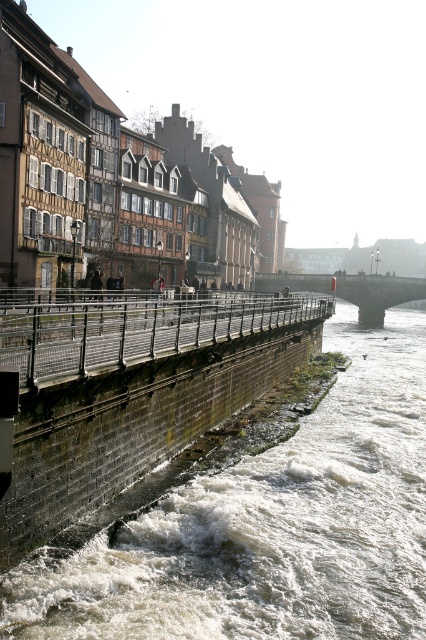
Measure the distance between rough concrete river at center and dark gray stone bridge at center.

rough concrete river at center is 114.19 feet away from dark gray stone bridge at center.

Image resolution: width=426 pixels, height=640 pixels. I want to click on rough concrete river at center, so click(x=273, y=525).

What are the coordinates of `rough concrete river at center` in the screenshot? It's located at (273, 525).

The height and width of the screenshot is (640, 426). I want to click on rough concrete river at center, so click(x=273, y=525).

Consider the image. Is metal/rustic rail at left to the left of dark gray stone bridge at center from the viewer's perspective?

Correct, you'll find metal/rustic rail at left to the left of dark gray stone bridge at center.

This screenshot has width=426, height=640. What do you see at coordinates (135, 330) in the screenshot? I see `metal/rustic rail at left` at bounding box center [135, 330].

The width and height of the screenshot is (426, 640). What are the coordinates of `metal/rustic rail at left` in the screenshot? It's located at (135, 330).

Is point (402, 541) behind point (167, 342)?

No, (402, 541) is closer to viewer.

Does rough concrete river at center have a smaller size compared to metal/rustic rail at left?

Yes.

Describe the element at coordinates (273, 525) in the screenshot. The height and width of the screenshot is (640, 426). I see `rough concrete river at center` at that location.

The width and height of the screenshot is (426, 640). I want to click on rough concrete river at center, so click(273, 525).